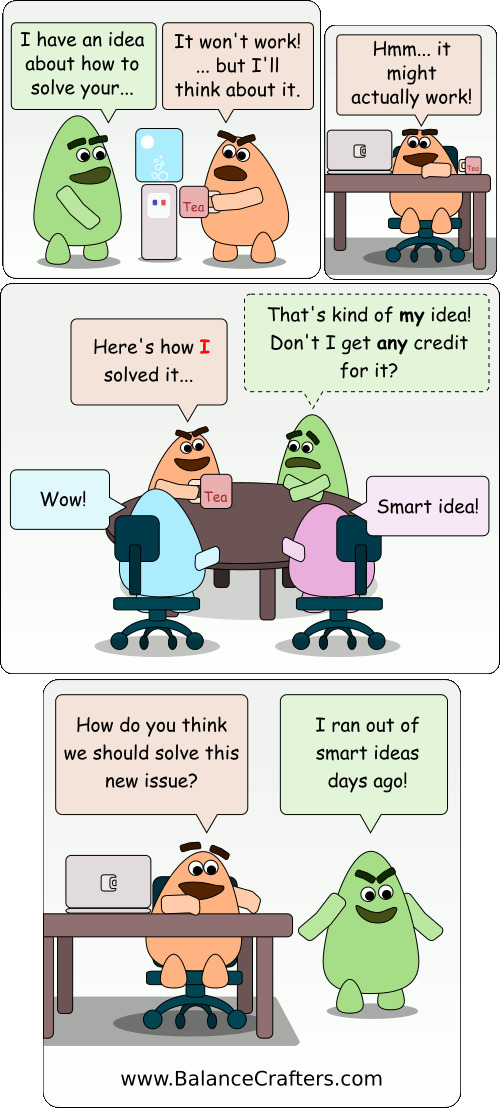
I want to click on chair, so click(x=422, y=232), click(x=155, y=616), click(x=338, y=615), click(x=197, y=992).